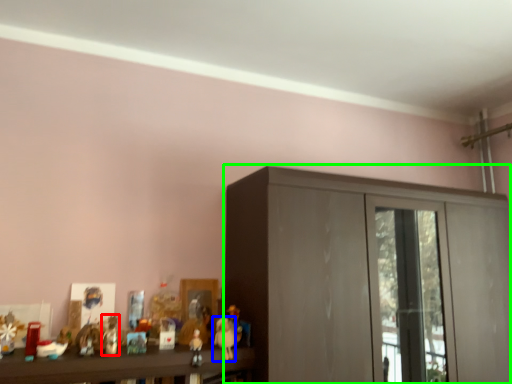
Question: Which object is the closest to the toy (highlighted by a red box)? Choose among these: toy (highlighted by a blue box) or cupboard (highlighted by a green box).

Choices:
 (A) toy
 (B) cupboard

Answer: (A)